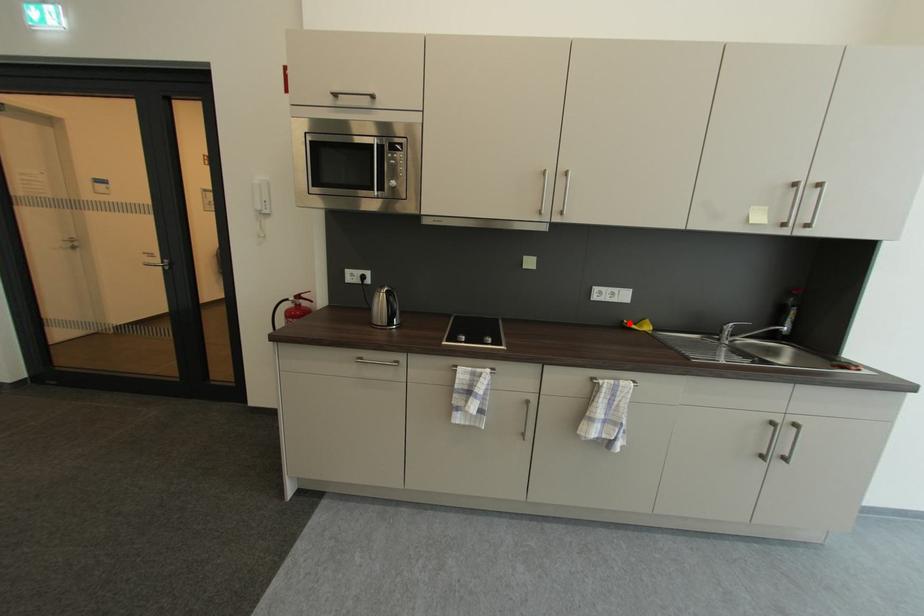
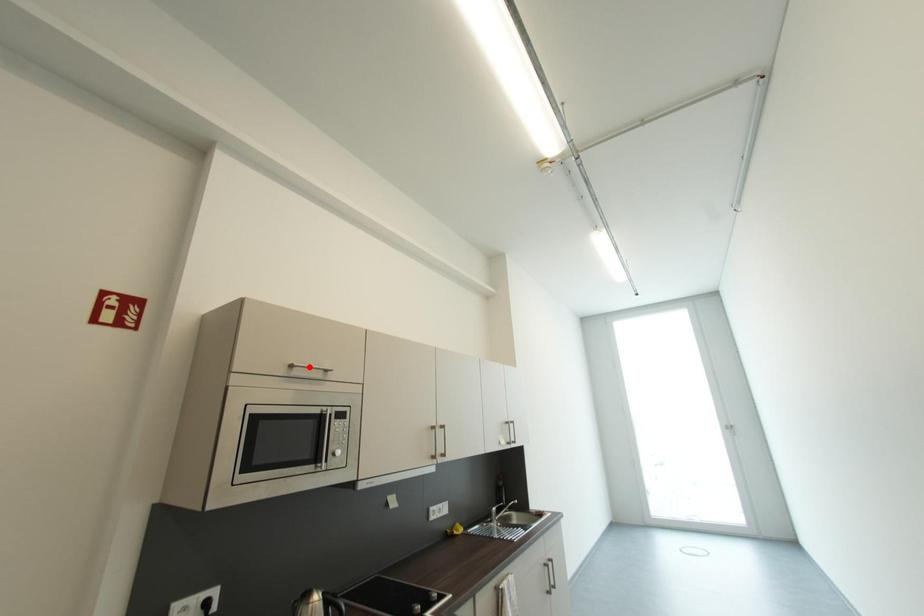
I am providing you with two images of the same scene from different viewpoints. A red point is marked on the first image and another point is marked on the second image. Does the point marked in image1 correspond to the same location as the one in image2?

No